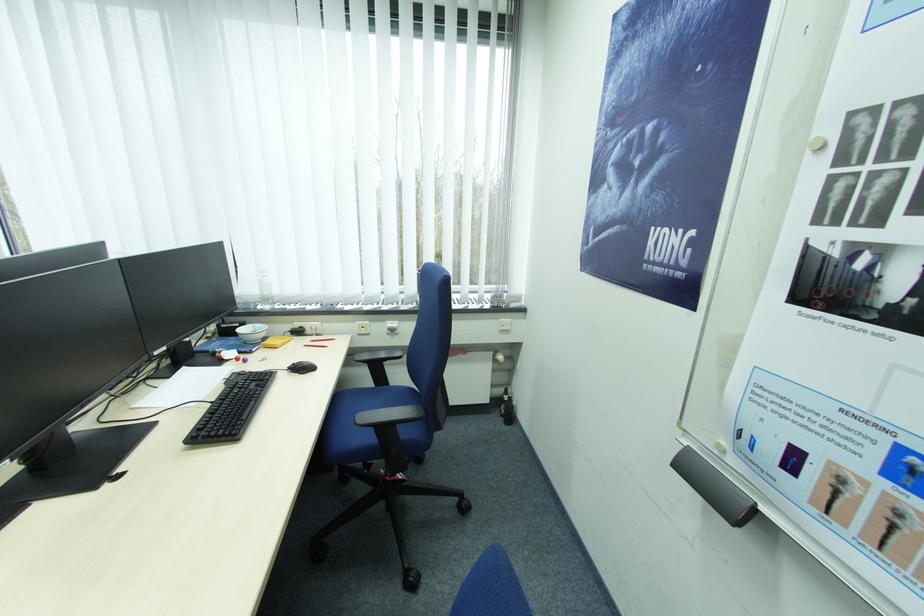
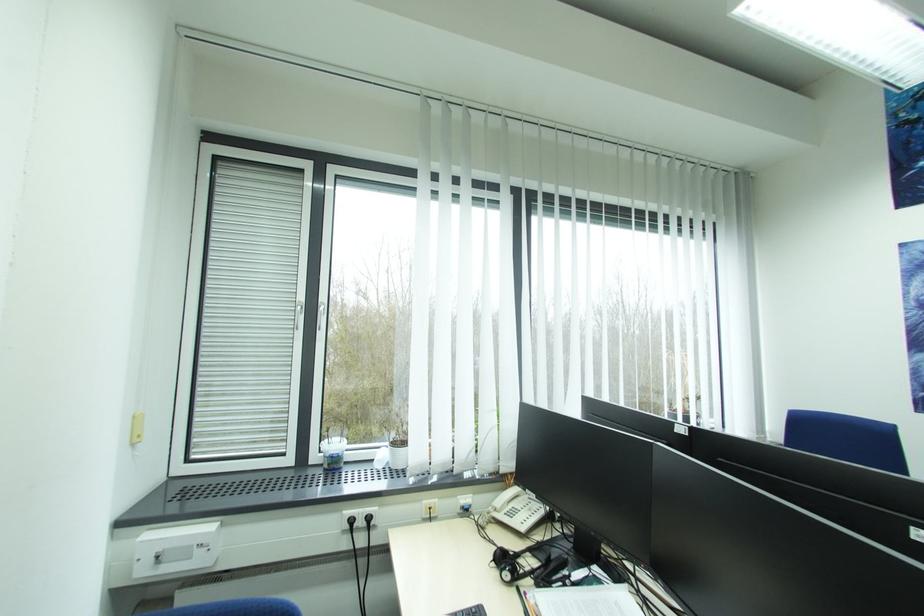
Question: Which direction would the cameraman need to move to produce the second image? Reply with the corresponding letter.

Choices:
 (A) Left
 (B) Right
 (C) Forward
 (D) Backward

Answer: (A)